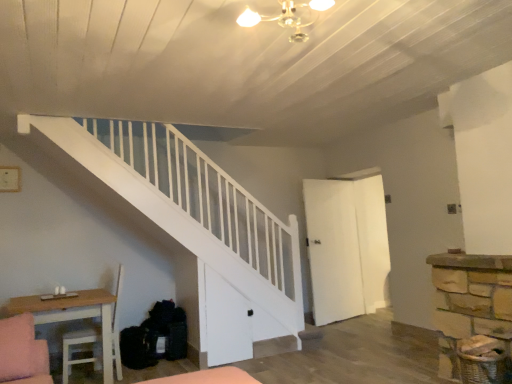
Question: In the image, is light wood table at lower left on the left side or the right side of white matte door at center-right?

Choices:
 (A) right
 (B) left

Answer: (B)

Question: Looking at their shapes, would you say light wood table at lower left is wider or thinner than white matte door at center-right?

Choices:
 (A) wide
 (B) thin

Answer: (A)

Question: Is light wood table at lower left inside the boundaries of white matte door at center-right, or outside?

Choices:
 (A) inside
 (B) outside

Answer: (B)

Question: From a real-world perspective, is white matte door at center-right above or below light wood table at lower left?

Choices:
 (A) above
 (B) below

Answer: (A)

Question: In terms of height, does white matte door at center-right look taller or shorter compared to light wood table at lower left?

Choices:
 (A) tall
 (B) short

Answer: (A)

Question: Do you think white matte door at center-right is within light wood table at lower left, or outside of it?

Choices:
 (A) outside
 (B) inside

Answer: (A)

Question: From the image's perspective, is white matte door at center-right above or below light wood table at lower left?

Choices:
 (A) above
 (B) below

Answer: (A)